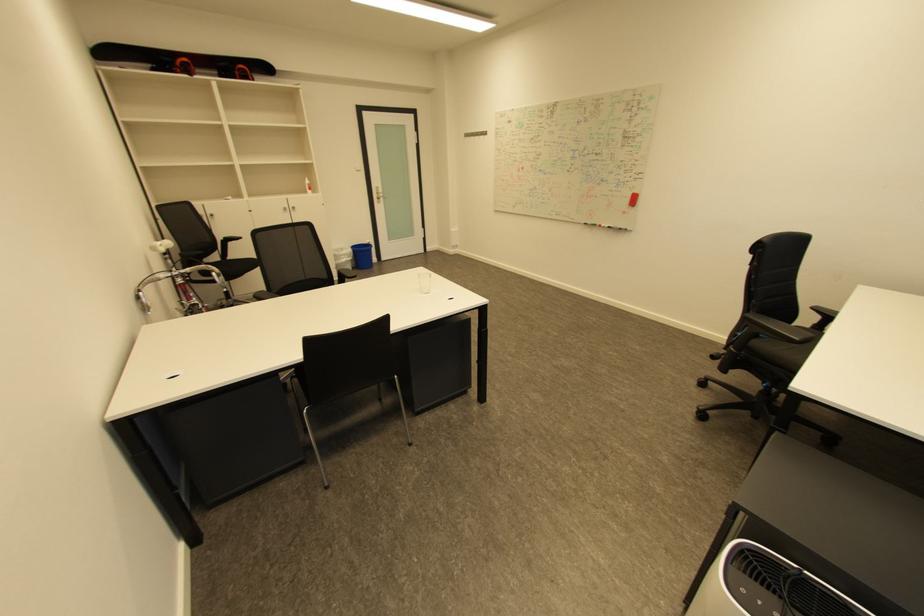
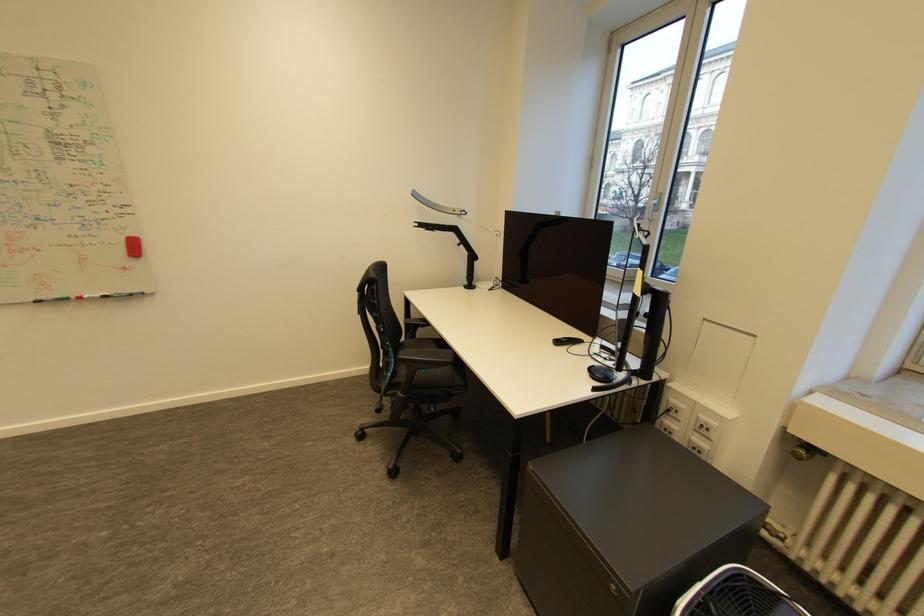
Question: The camera is either moving clockwise (left) or counter-clockwise (right) around the object. The first image is from the beginning of the video and the second image is from the end. Is the camera moving left or right when shooting the video?

Choices:
 (A) Left
 (B) Right

Answer: (A)